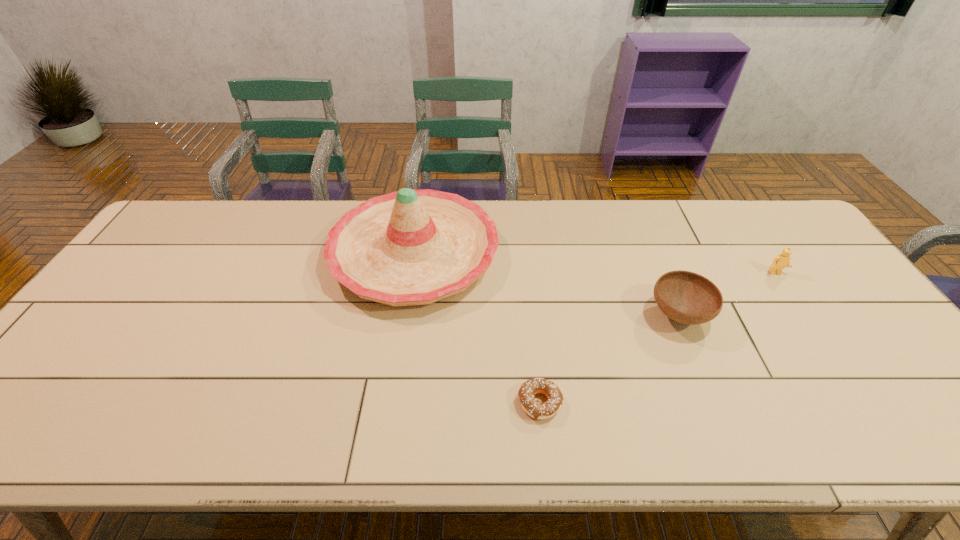
This screenshot has width=960, height=540. What are the coordinates of `object located in the far edge section of the desktop` in the screenshot? It's located at (411, 247).

Find the location of a particular element. The height and width of the screenshot is (540, 960). object that is positioned at the near edge is located at coordinates (534, 408).

Locate an element on the screen. This screenshot has width=960, height=540. object that is at the right edge is located at coordinates (782, 260).

In the image, there is a desktop. In order to click on blank space at the far edge in this screenshot , I will do tap(701, 215).

Where is `vacant space at the near edge of the desktop`? This screenshot has height=540, width=960. vacant space at the near edge of the desktop is located at coordinates (490, 429).

Find the location of a particular element. vacant area at the left edge of the desktop is located at coordinates (186, 254).

This screenshot has height=540, width=960. Identify the location of vacant area at the right edge of the desktop. (824, 298).

At what (x,y) coordinates should I click in order to perform the action: click on free space at the far left corner of the desktop. Please return your answer as a coordinate pair (x, y). Looking at the image, I should click on (166, 244).

Locate an element on the screen. The image size is (960, 540). free space at the far right corner is located at coordinates (788, 239).

Image resolution: width=960 pixels, height=540 pixels. I want to click on empty space that is in between the leftmost object and the second object from left to right, so pos(477,328).